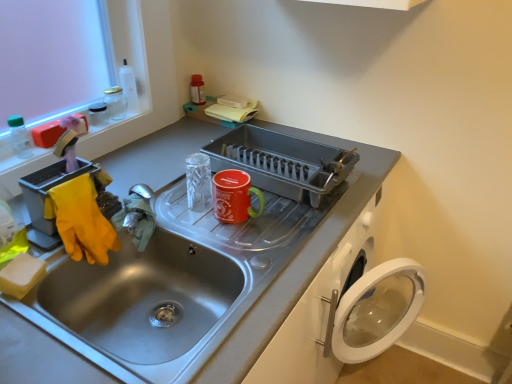
Question: Considering the positions of stainless steel sink at center and clear glass jar at upper left, placed as the first appliance when sorted from left to right, in the image, is stainless steel sink at center wider or thinner than clear glass jar at upper left, placed as the first appliance when sorted from left to right,?

Choices:
 (A) thin
 (B) wide

Answer: (B)

Question: Does point (23, 314) appear closer or farther from the camera than point (95, 107)?

Choices:
 (A) closer
 (B) farther

Answer: (A)

Question: Based on their relative distances, which object is farther from the clear glass jar at upper left, placed as the first appliance when sorted from left to right?

Choices:
 (A) transparent plastic bottle at upper left
 (B) glossy ceramic mug at upper center, the second appliance in the right-to-left sequence
 (C) metallic gray dish rack at center, the third appliance from the left
 (D) stainless steel sink at center

Answer: (D)

Question: Which object is the closest to the clear glass jar at upper left, placed as the first appliance when sorted from left to right?

Choices:
 (A) transparent plastic bottle at upper left
 (B) glossy ceramic mug at upper center, arranged as the 2th appliance when viewed from the left
 (C) metallic gray dish rack at center, the third appliance from the left
 (D) stainless steel sink at center

Answer: (A)